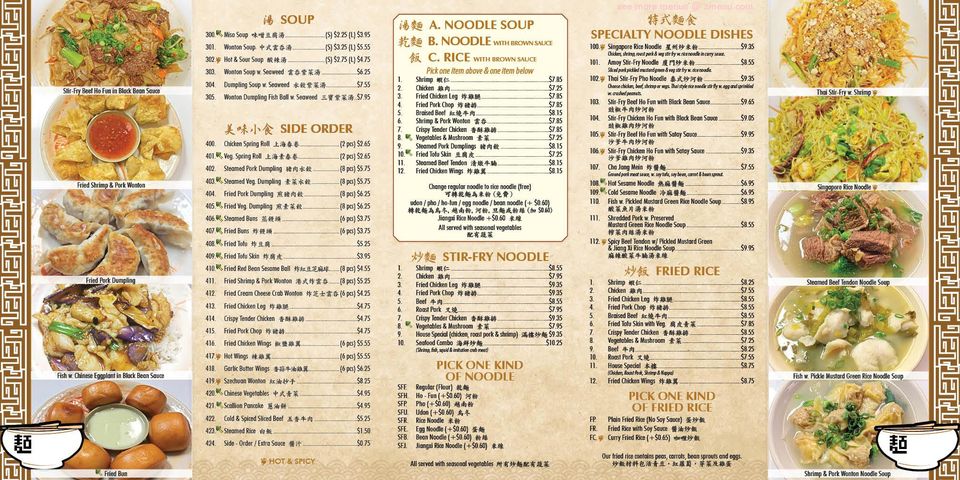
Identify the location of photo of dishes on the right side. (844, 31), (852, 134), (836, 217), (842, 319), (842, 394).